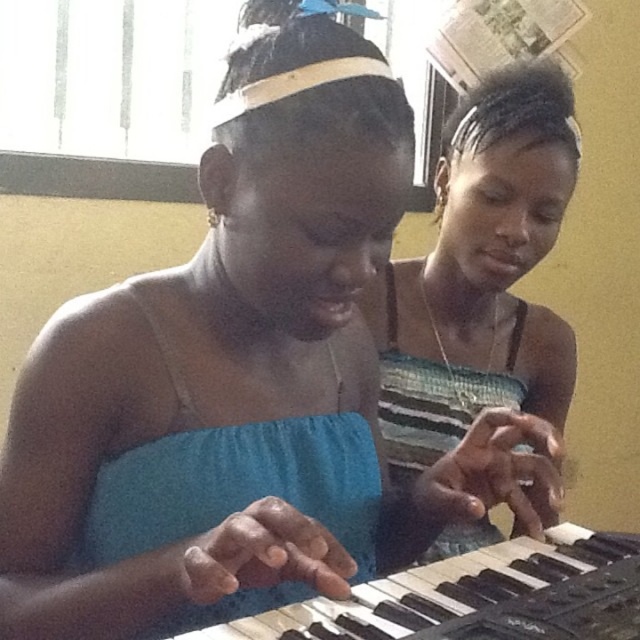
Is striped fabric dress at center to the right of black plastic keyboard at center from the viewer's perspective?

Indeed, striped fabric dress at center is positioned on the right side of black plastic keyboard at center.

Between striped fabric dress at center and black plastic keyboard at center, which one has less height?

black plastic keyboard at center

Between point (392, 356) and point (438, 602), which one is positioned behind?

The point (392, 356) is behind.

Image resolution: width=640 pixels, height=640 pixels. Identify the location of striped fabric dress at center. (481, 273).